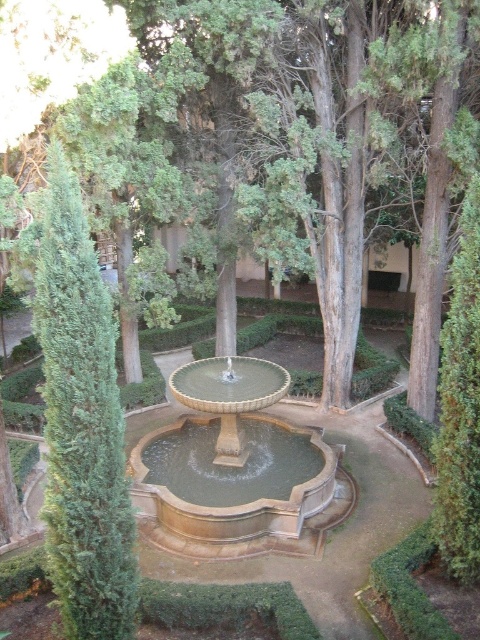
Based on the photo, you are planning to place a new bench in the garden. The bench requires a space that is wider than the stone fountain at center. Based on the scene, is there a suitable location near the green leafy tree at center where the bench can be placed?

The green leafy tree at center might be wider than the stone fountain at center, so there could be a suitable location near the green leafy tree at center where the bench can be placed if the width meets the requirement.

You are a gardener planning to trim the green textured bush at left and the stone fountain at center. Based on their positions, which object is closer to the front of the garden?

The green textured bush at left is closer to the front of the garden because it is positioned over the stone fountain at center, indicating it is in front.